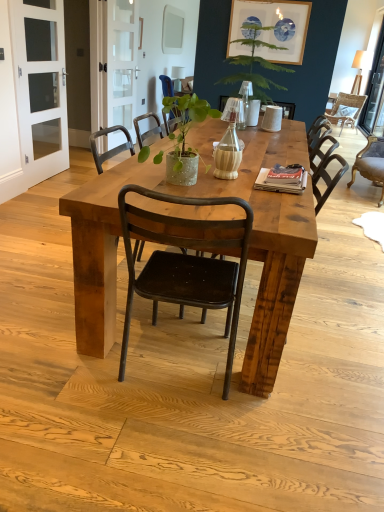
Question: Is brown leather chair at right, the 3th chair in the top-to-bottom sequence, aimed at rustic wood chair at center, the 1th chair from the bottom?

Choices:
 (A) no
 (B) yes

Answer: (A)

Question: Considering the relative sizes of brown leather chair at right, the second chair positioned from the bottom, and rustic wood chair at center, which appears as the 4th chair when viewed from the top, in the image provided, is brown leather chair at right, the second chair positioned from the bottom, wider than rustic wood chair at center, which appears as the 4th chair when viewed from the top,?

Choices:
 (A) no
 (B) yes

Answer: (A)

Question: From a real-world perspective, is brown leather chair at right, which is the 2th chair in right-to-left order, located higher than rustic wood chair at center, positioned as the third chair in right-to-left order?

Choices:
 (A) yes
 (B) no

Answer: (B)

Question: Does brown leather chair at right, which appears as the third chair when viewed from the back, appear on the left side of rustic wood chair at center, which is counted as the 1th chair, starting from the front?

Choices:
 (A) yes
 (B) no

Answer: (B)

Question: From a real-world perspective, is brown leather chair at right, which is the 2th chair in right-to-left order, located beneath rustic wood chair at center, arranged as the second chair when viewed from the left?

Choices:
 (A) no
 (B) yes

Answer: (B)

Question: Is brown leather chair at right, which appears as the third chair when viewed from the back, not within rustic wood chair at center, which appears as the 4th chair when viewed from the top?

Choices:
 (A) yes
 (B) no

Answer: (A)

Question: Can metallic black chair at center, which appears as the second chair when viewed from the back, be found inside rustic wood table at center?

Choices:
 (A) no
 (B) yes

Answer: (A)

Question: From the image's perspective, would you say rustic wood table at center is shown under metallic black chair at center, which appears as the third chair when viewed from the front?

Choices:
 (A) no
 (B) yes

Answer: (B)

Question: Does rustic wood table at center have a lesser width compared to metallic black chair at center, which appears as the third chair when viewed from the front?

Choices:
 (A) no
 (B) yes

Answer: (A)

Question: Considering the relative positions of rustic wood table at center and metallic black chair at center, the second chair when ordered from top to bottom, in the image provided, is rustic wood table at center to the right of metallic black chair at center, the second chair when ordered from top to bottom, from the viewer's perspective?

Choices:
 (A) yes
 (B) no

Answer: (A)

Question: From the image's perspective, is rustic wood table at center on metallic black chair at center, which ranks as the third chair in bottom-to-top order?

Choices:
 (A) no
 (B) yes

Answer: (A)

Question: Considering the relative sizes of rustic wood table at center and metallic black chair at center, which appears as the second chair when viewed from the back, in the image provided, is rustic wood table at center bigger than metallic black chair at center, which appears as the second chair when viewed from the back,?

Choices:
 (A) no
 (B) yes

Answer: (B)

Question: Considering the relative sizes of white matte picture frame at upper center and white glass screen door at left, the 1th screen door in the left-to-right sequence, in the image provided, is white matte picture frame at upper center smaller than white glass screen door at left, the 1th screen door in the left-to-right sequence,?

Choices:
 (A) no
 (B) yes

Answer: (B)